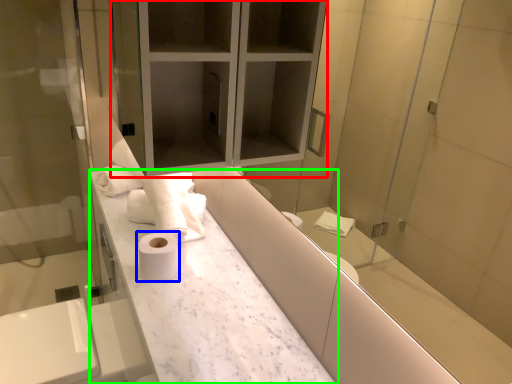
Question: Which object is the farthest from medicine cabinet (highlighted by a red box)? Choose among these: toilet paper (highlighted by a blue box) or counter (highlighted by a green box).

Choices:
 (A) toilet paper
 (B) counter

Answer: (A)